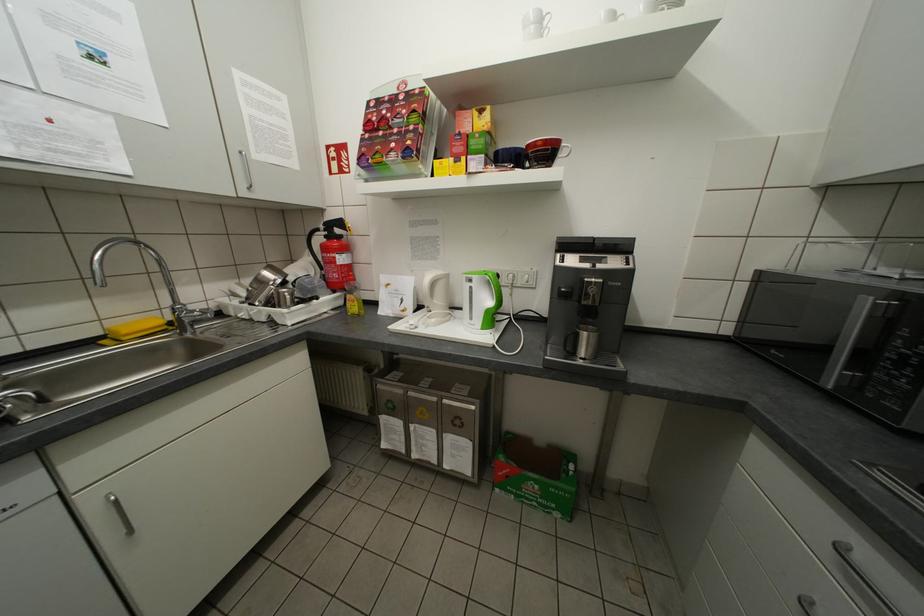
The height and width of the screenshot is (616, 924). What do you see at coordinates (335, 225) in the screenshot? I see `a extinguisher lever` at bounding box center [335, 225].